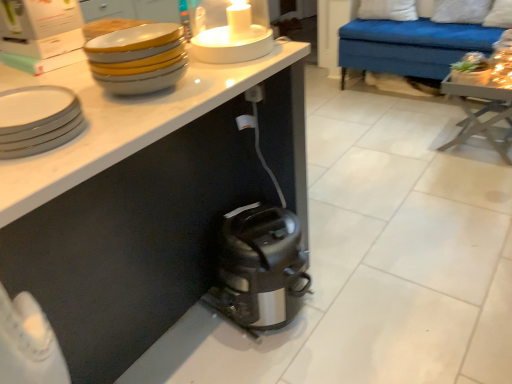
Identify the location of vacant space behind wooden table at right. (431, 116).